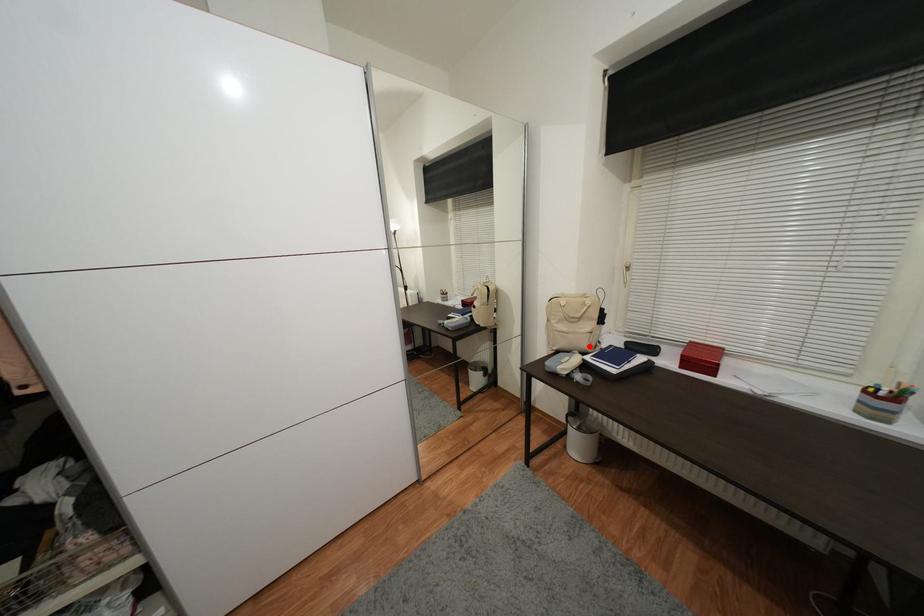
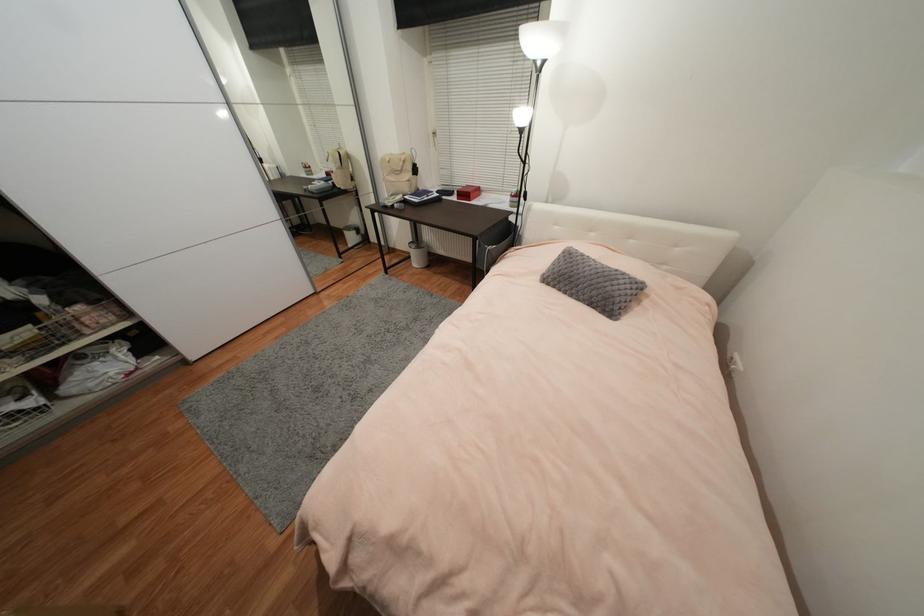
Question: I am providing you with two images of the same scene from different viewpoints. A red point is marked on the first image. At the location where the point appears in image 1, is it still visible in image 2?

Choices:
 (A) Yes
 (B) No

Answer: (A)